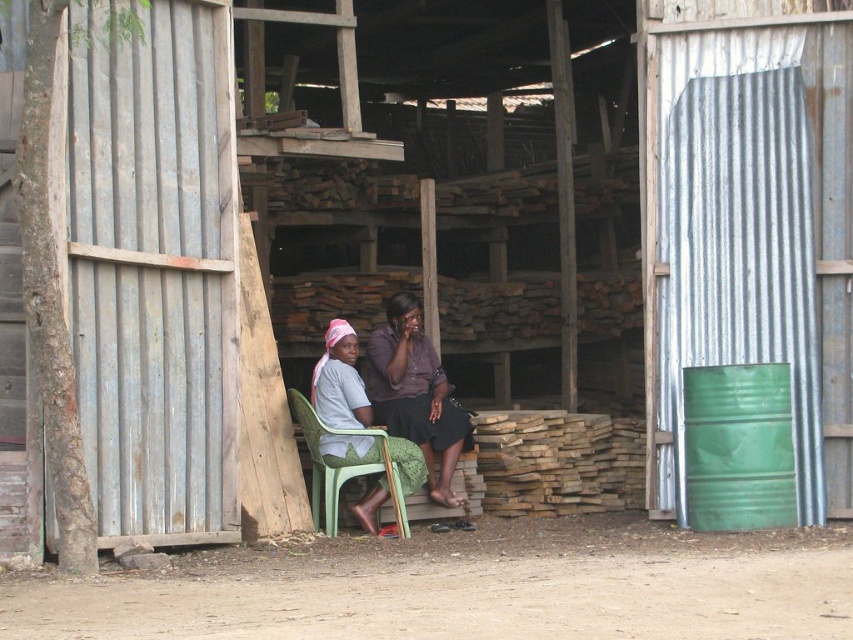
Question: Which point is closer to the camera taking this photo?

Choices:
 (A) pos(322,486)
 (B) pos(440,420)
 (C) pos(756,500)

Answer: (C)

Question: Which is nearer to the green matte barrel at right?

Choices:
 (A) matte purple blouse at center
 (B) green plastic chair at center

Answer: (B)

Question: Is green matte barrel at right positioned in front of green plastic chair at center?

Choices:
 (A) no
 (B) yes

Answer: (B)

Question: Is green matte barrel at right wider than matte purple blouse at center?

Choices:
 (A) yes
 (B) no

Answer: (B)

Question: Is matte purple blouse at center thinner than green plastic chair at center?

Choices:
 (A) yes
 (B) no

Answer: (A)

Question: Which of these objects is positioned closest to the green plastic chair at center?

Choices:
 (A) green matte barrel at right
 (B) matte purple blouse at center

Answer: (B)